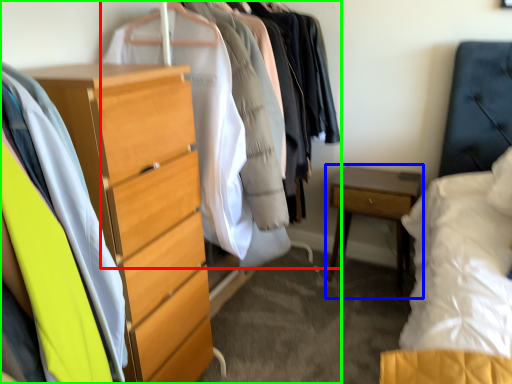
Question: Which is farther away from closet (highlighted by a red box)? nightstand (highlighted by a blue box) or closet (highlighted by a green box)?

Choices:
 (A) nightstand
 (B) closet

Answer: (A)